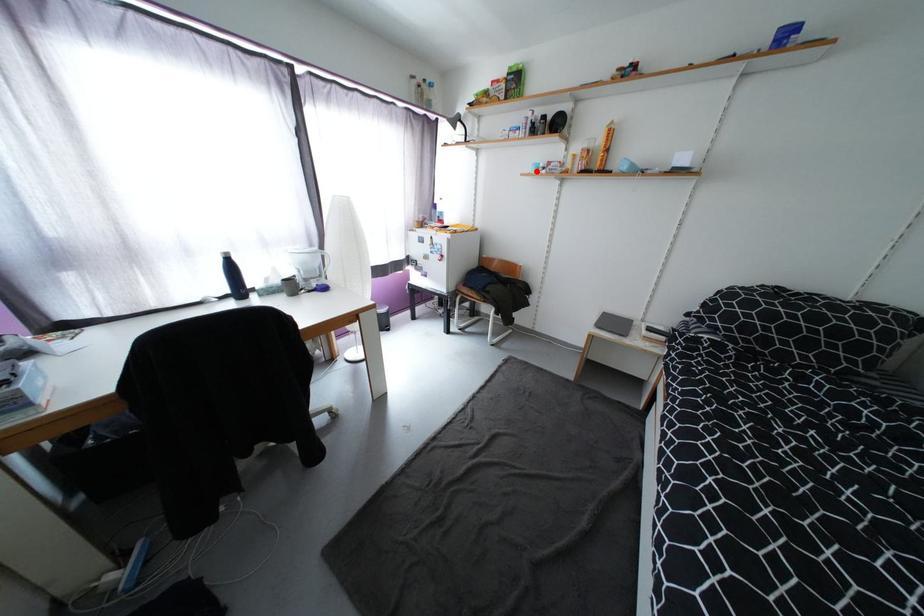
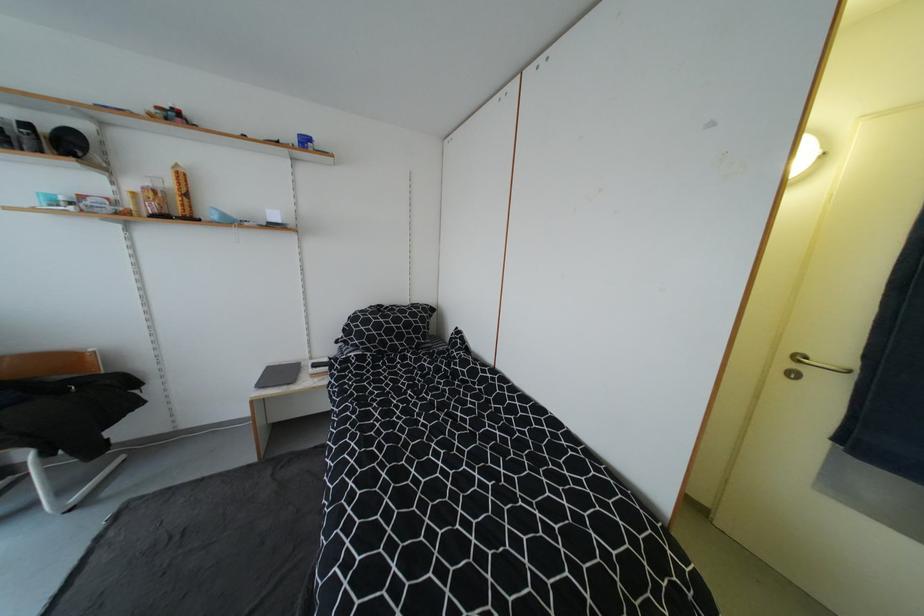
Question: I am providing you with two images of the same scene from different viewpoints. A red point is marked on the first image. At the location where the point appears in image 1, is it still visible in image 2?

Choices:
 (A) Yes
 (B) No

Answer: (A)